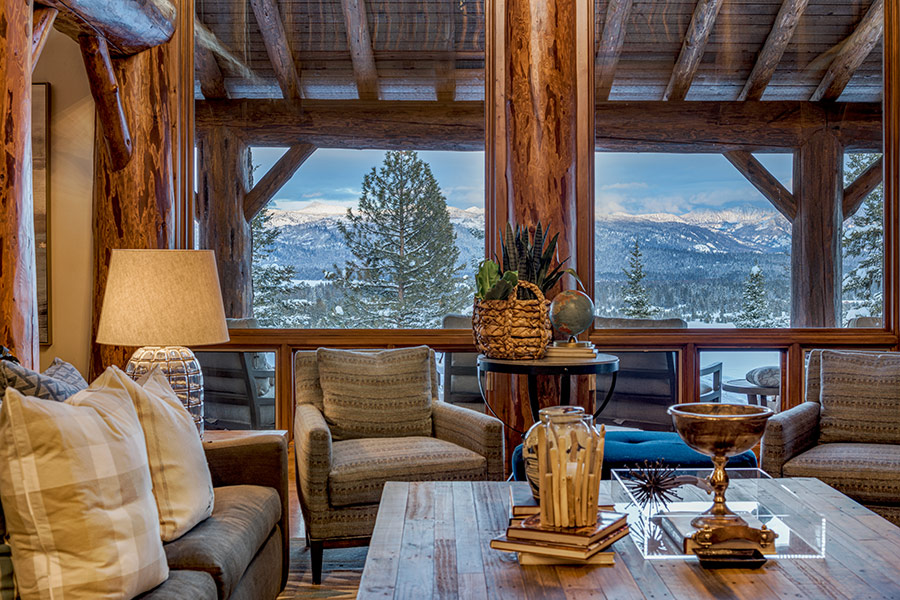
Find the location of `light brown lampshade`. light brown lampshade is located at coordinates (168, 304).